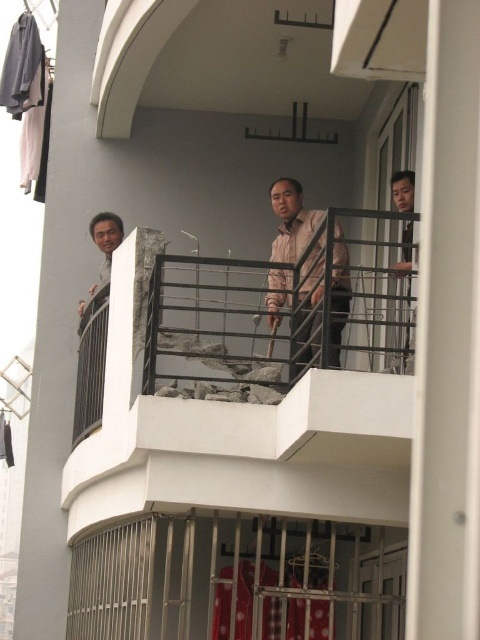
Question: Which of the following is the farthest from the observer?

Choices:
 (A) (410, 179)
 (B) (319, 289)

Answer: (A)

Question: Does pink matte shirt at center appear on the left side of matte black shirt at upper right?

Choices:
 (A) no
 (B) yes

Answer: (B)

Question: Is pink matte shirt at center wider than matte black shirt at upper right?

Choices:
 (A) yes
 (B) no

Answer: (A)

Question: Does pink matte shirt at center appear under matte black shirt at upper right?

Choices:
 (A) no
 (B) yes

Answer: (B)

Question: Which object is closer to the camera taking this photo?

Choices:
 (A) matte black shirt at upper right
 (B) pink matte shirt at center

Answer: (B)

Question: Among these objects, which one is nearest to the camera?

Choices:
 (A) matte black shirt at upper right
 (B) pink matte shirt at center

Answer: (B)